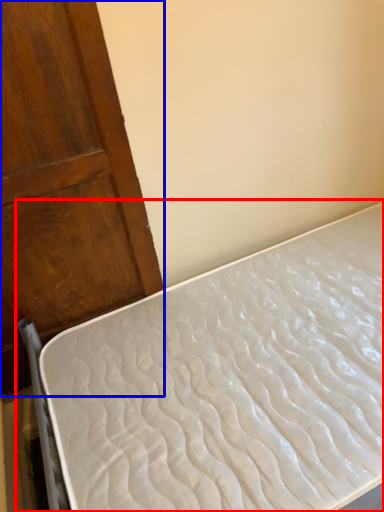
Question: Which of the following is the closest to the observer, bed (highlighted by a red box) or door (highlighted by a blue box)?

Choices:
 (A) bed
 (B) door

Answer: (A)